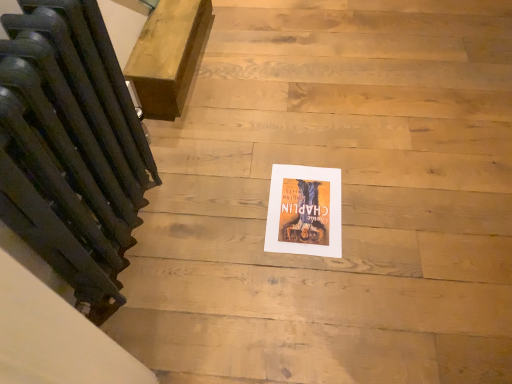
Locate an element on the screen. Image resolution: width=512 pixels, height=384 pixels. wooden bench at upper left is located at coordinates (169, 55).

Is matte paper poster at center oriented towards matte black radiator at left?

Result: No, matte paper poster at center does not turn towards matte black radiator at left.

Can you confirm if matte paper poster at center is smaller than matte black radiator at left?

Yes.

Which object is positioned more to the left, matte paper poster at center or matte black radiator at left?

matte black radiator at left is more to the left.

From a real-world perspective, which object rests below the other?

From a 3D spatial view, matte paper poster at center is below.

Based on their positions, is matte black radiator at left located to the left or right of matte paper poster at center?

From the image, it's evident that matte black radiator at left is to the left of matte paper poster at center.

Does matte black radiator at left have a greater height compared to matte paper poster at center?

Correct, matte black radiator at left is much taller as matte paper poster at center.

Considering the sizes of objects matte black radiator at left and matte paper poster at center in the image provided, who is wider, matte black radiator at left or matte paper poster at center?

matte paper poster at center is wider.

Relative to matte paper poster at center, is matte black radiator at left in front or behind?

matte black radiator at left is in front of matte paper poster at center.

Who is bigger, matte black radiator at left or wooden bench at upper left?

With larger size is wooden bench at upper left.

Find the location of a particular element. This screenshot has width=512, height=384. furniture on the left of matte black radiator at left is located at coordinates (169, 55).

Is point (120, 133) positioned behind point (170, 52)?

No, (120, 133) is closer to viewer.

Could you tell me if matte black radiator at left is facing wooden bench at upper left?

No, matte black radiator at left is not turned towards wooden bench at upper left.

Would you say matte paper poster at center is to the left or to the right of wooden bench at upper left in the picture?

From the image, it's evident that matte paper poster at center is to the right of wooden bench at upper left.

Considering the positions of objects matte paper poster at center and wooden bench at upper left in the image provided, who is in front, matte paper poster at center or wooden bench at upper left?

matte paper poster at center.

Are matte paper poster at center and wooden bench at upper left making contact?

No, matte paper poster at center is not beside wooden bench at upper left.

Considering the relative sizes of matte paper poster at center and wooden bench at upper left in the image provided, is matte paper poster at center smaller than wooden bench at upper left?

Correct, matte paper poster at center occupies less space than wooden bench at upper left.

Considering their positions, is wooden bench at upper left located in front of or behind matte black radiator at left?

Visually, wooden bench at upper left is located behind matte black radiator at left.

Can you tell me how much wooden bench at upper left and matte black radiator at left differ in facing direction?

The angular difference between wooden bench at upper left and matte black radiator at left is 86.9 degrees.

Does wooden bench at upper left have a smaller size compared to matte black radiator at left?

Actually, wooden bench at upper left might be larger than matte black radiator at left.

Is wooden bench at upper left in front of or behind matte paper poster at center in the image?

wooden bench at upper left is behind matte paper poster at center.

Would you say matte paper poster at center is part of wooden bench at upper left's contents?

That's incorrect, matte paper poster at center is not inside wooden bench at upper left.

From the picture: Does wooden bench at upper left have a larger size compared to matte paper poster at center?

Indeed, wooden bench at upper left has a larger size compared to matte paper poster at center.

From a real-world perspective, is wooden bench at upper left above or below matte paper poster at center?

wooden bench at upper left is situated higher than matte paper poster at center in the real world.

The image size is (512, 384). Find the location of `radiator lying on the left of matte paper poster at center`. radiator lying on the left of matte paper poster at center is located at coordinates (71, 148).

You are a GUI agent. You are given a task and a screenshot of the screen. Output one action in this format:
    pyautogui.click(x=<x>, y=<y>)
    Task: Click on the radiator located above the matte paper poster at center (from the image's perspective)
    This screenshot has height=384, width=512.
    Given the screenshot: What is the action you would take?
    pyautogui.click(x=71, y=148)

Considering their positions, is matte paper poster at center positioned further to wooden bench at upper left than matte black radiator at left?

matte paper poster at center lies further to wooden bench at upper left than the other object.

From the image, which object appears to be farther from matte black radiator at left, matte paper poster at center or wooden bench at upper left?

matte paper poster at center lies further to matte black radiator at left than the other object.

Based on their spatial positions, is matte black radiator at left or wooden bench at upper left closer to matte paper poster at center?

Based on the image, matte black radiator at left appears to be nearer to matte paper poster at center.

Which object lies nearer to the anchor point matte black radiator at left, wooden bench at upper left or matte paper poster at center?

wooden bench at upper left is closer to matte black radiator at left.

Considering their positions, is matte black radiator at left positioned further to wooden bench at upper left than matte paper poster at center?

Among the two, matte paper poster at center is located further to wooden bench at upper left.

From the image, which object appears to be farther from matte paper poster at center, wooden bench at upper left or matte black radiator at left?

wooden bench at upper left.

Identify the location of flyer located between matte black radiator at left and wooden bench at upper left in the depth direction. (304, 211).